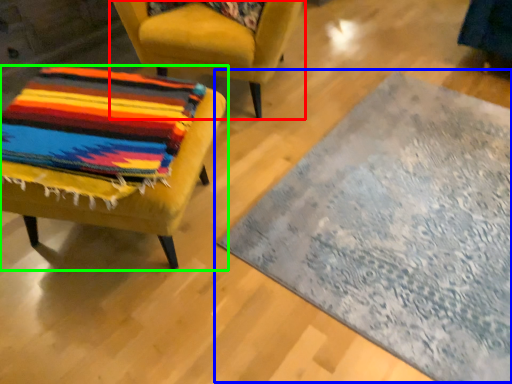
Question: Which object is positioned farthest from chair (highlighted by a red box)? Select from mat (highlighted by a blue box) and chair (highlighted by a green box).

Choices:
 (A) mat
 (B) chair

Answer: (A)